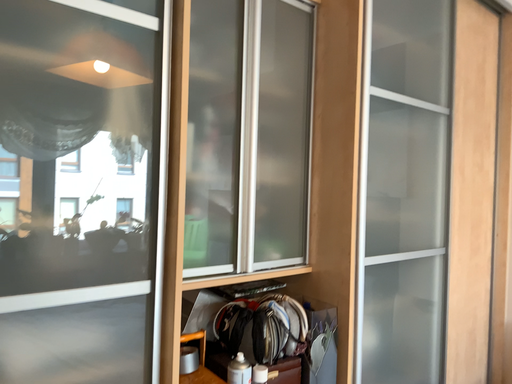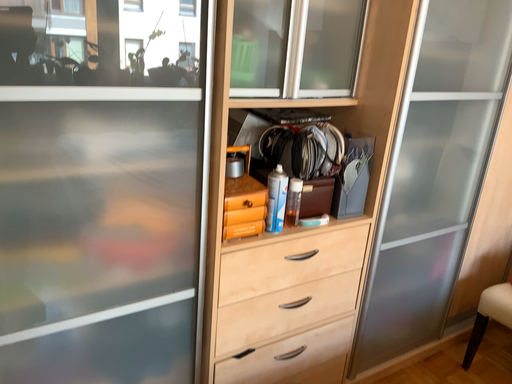
Question: Which way did the camera rotate in the video?

Choices:
 (A) rotated upward
 (B) rotated downward

Answer: (B)